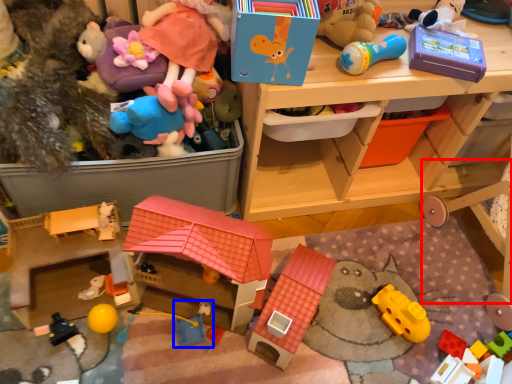
Question: Which point is further to the camera, bunk bed (highlighted by a red box) or toy (highlighted by a blue box)?

Choices:
 (A) bunk bed
 (B) toy

Answer: (B)